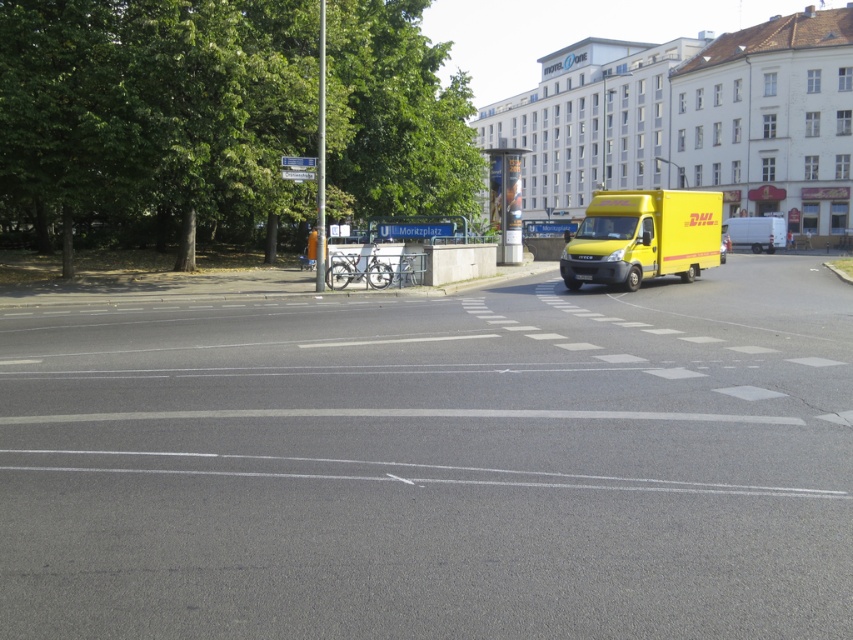
Question: Among these objects, which one is nearest to the camera?

Choices:
 (A) green leafy tree at upper left
 (B) yellow matte van at center
 (C) yellow rubber van at right

Answer: (A)

Question: Can you confirm if yellow matte van at center is positioned to the right of yellow rubber van at right?

Choices:
 (A) yes
 (B) no

Answer: (B)

Question: Which object is positioned farthest from the yellow rubber van at right?

Choices:
 (A) yellow matte van at center
 (B) green leafy tree at upper left

Answer: (B)

Question: Does green leafy tree at upper left have a smaller size compared to yellow matte van at center?

Choices:
 (A) no
 (B) yes

Answer: (A)

Question: In this image, where is green leafy tree at upper left located relative to yellow matte van at center?

Choices:
 (A) above
 (B) below

Answer: (A)

Question: Estimate the real-world distances between objects in this image. Which object is closer to the yellow matte van at center?

Choices:
 (A) green leafy tree at upper left
 (B) yellow rubber van at right

Answer: (A)